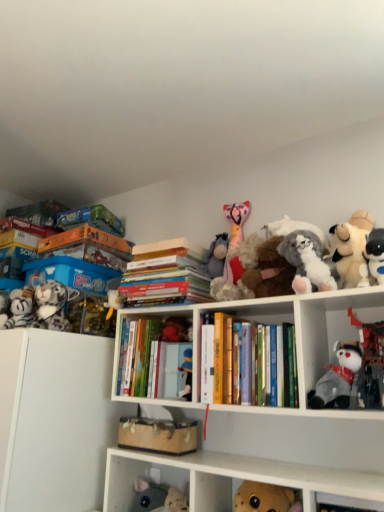
Question: Considering their positions, is white plush toy at right, the first toy when ordered from right to left, located in front of or behind velvet plush bear at center, the 8th toy positioned from the right?

Choices:
 (A) front
 (B) behind

Answer: (A)

Question: Based on their positions, is white plush toy at right, the first toy when ordered from right to left, located to the left or right of velvet plush bear at center, which ranks as the third toy in left-to-right order?

Choices:
 (A) right
 (B) left

Answer: (A)

Question: Which object is the farthest from the fluffy white stuffed animal at upper right, which ranks as the eighth toy in left-to-right order?

Choices:
 (A) white matte cabinet at left
 (B) white plush toy at upper right, which is the 2th toy in right-to-left order
 (C) matte plastic toy at center, marked as the 4th toy in a left-to-right arrangement
 (D) fuzzy fabric stuffed animal at lower left, placed as the 2th cabinet when sorted from top to bottom
 (E) hardcover books at center, the second book viewed from the right

Answer: (A)

Question: Which of these objects is positioned farthest from the matte plastic toy at center, the 7th toy when ordered from right to left?

Choices:
 (A) fluffy white stuffed animal at upper right, which is the 3th toy from right to left
 (B) gray plush toy at center-right, which is the seventh toy from left to right
 (C) fluffy gray plush at left, the 2th toy in the left-to-right sequence
 (D) fuzzy fabric stuffed animal at lower left, placed as the 2th cabinet when sorted from top to bottom
 (E) white plush toy at upper right, which ranks as the 9th toy in left-to-right order

Answer: (E)